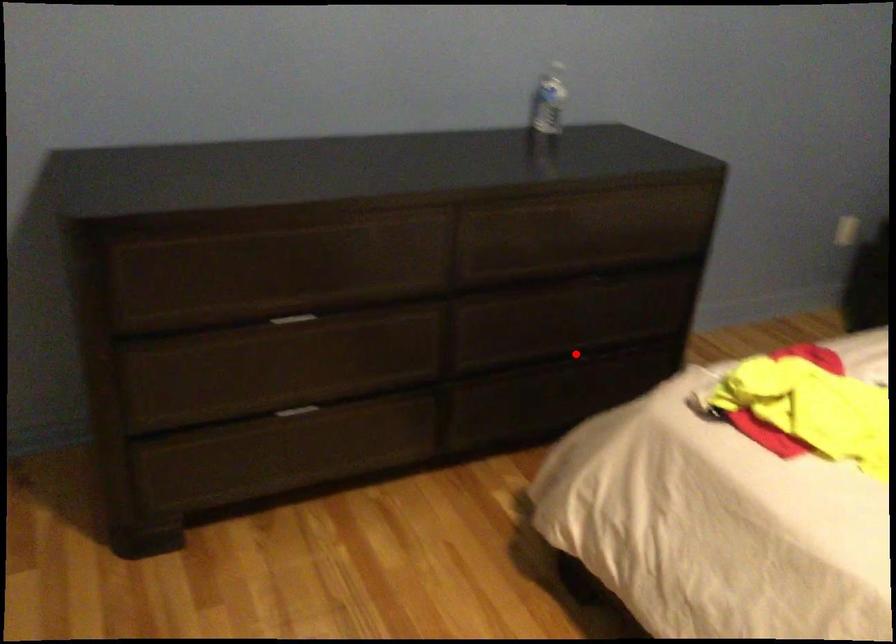
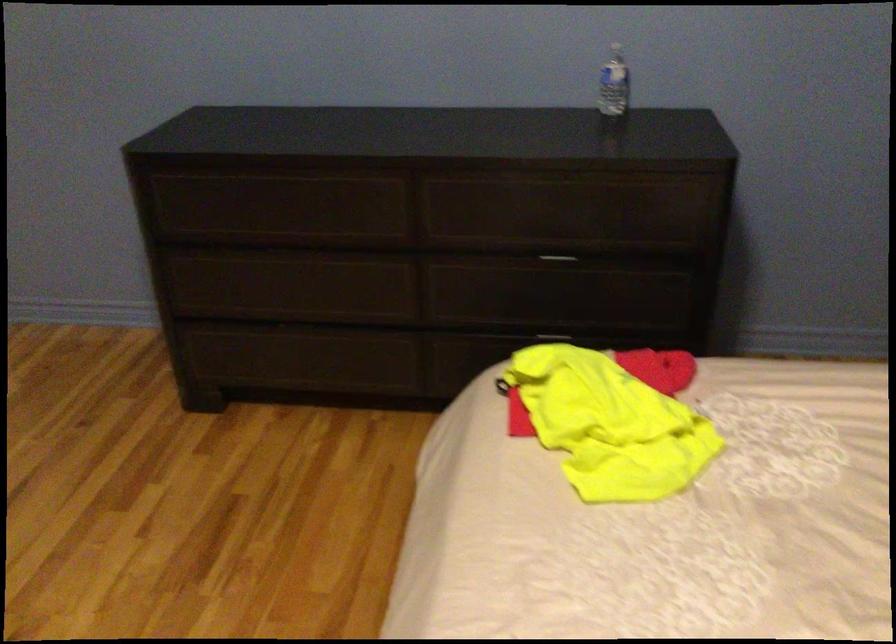
In the second image, find the point that corresponds to the highlighted location in the first image.

(553, 333)